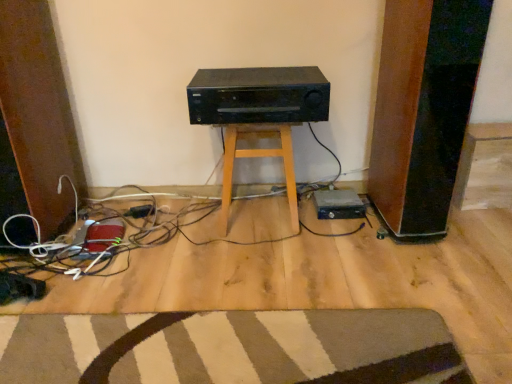
Identify the location of unoccupied area in front of black plastic hard drive at lower right. (343, 233).